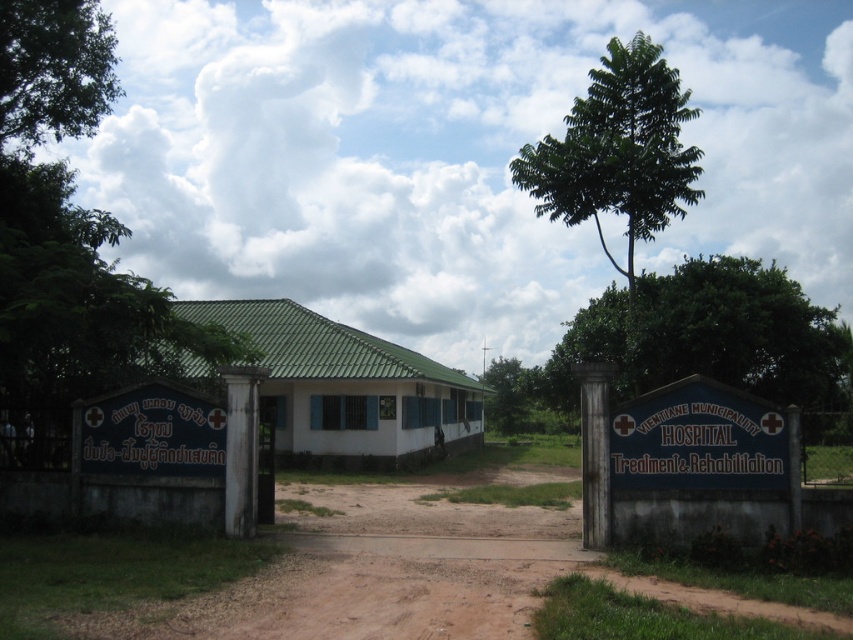
From the picture: Who is more forward, (x=485, y=476) or (x=125, y=236)?

Point (x=125, y=236) is in front.

At what (x,y) coordinates should I click in order to perform the action: click on brown dirt field at center. Please return your answer as a coordinate pair (x, y). The width and height of the screenshot is (853, 640). Looking at the image, I should click on (408, 573).

Where is `brown dirt field at center`? The width and height of the screenshot is (853, 640). brown dirt field at center is located at coordinates (408, 573).

Between brown dirt field at center and blue painted signboard at center, which one appears on the left side from the viewer's perspective?

brown dirt field at center

Does brown dirt field at center have a lesser height compared to blue painted signboard at center?

Yes.

What do you see at coordinates (408, 573) in the screenshot? The height and width of the screenshot is (640, 853). I see `brown dirt field at center` at bounding box center [408, 573].

Identify the location of brown dirt field at center. The height and width of the screenshot is (640, 853). (408, 573).

Is green leafy tree at center positioned behind blue painted signboard at center?

Yes, green leafy tree at center is further from the viewer.

Who is lower down, green leafy tree at center or blue painted signboard at center?

blue painted signboard at center is lower down.

In order to click on green leafy tree at center in this screenshot , I will do click(685, 342).